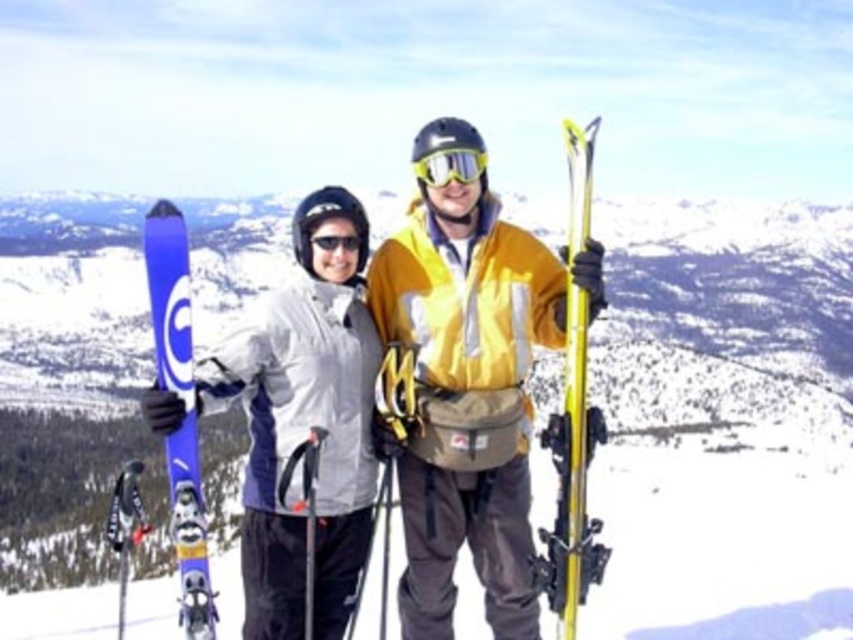
Is matte blue skis at center taller than yellow metallic ski at right?

In fact, matte blue skis at center may be shorter than yellow metallic ski at right.

Can you confirm if matte blue skis at center is thinner than yellow metallic ski at right?

In fact, matte blue skis at center might be wider than yellow metallic ski at right.

Between point (425, 362) and point (567, 145), which one is positioned behind?

Point (425, 362)

At what (x,y) coordinates should I click in order to perform the action: click on matte blue skis at center. Please return your answer as a coordinate pair (x, y). The width and height of the screenshot is (853, 640). Looking at the image, I should click on (482, 396).

Is point (451, 380) less distant than point (444, 179)?

Yes, point (451, 380) is closer to viewer.

The height and width of the screenshot is (640, 853). Describe the element at coordinates (482, 396) in the screenshot. I see `matte blue skis at center` at that location.

Between point (462, 529) and point (468, 164), which one is positioned behind?

The point (462, 529) is more distant.

At what (x,y) coordinates should I click in order to perform the action: click on matte blue skis at center. Please return your answer as a coordinate pair (x, y). Looking at the image, I should click on (482, 396).

Is matte blue snowboard at left further to camera compared to glossy plastic goggles at center?

That is False.

Which is in front, point (219, 394) or point (457, 157)?

Positioned in front is point (219, 394).

Is point (279, 616) positioned behind point (461, 177)?

No, it is not.

You are a GUI agent. You are given a task and a screenshot of the screen. Output one action in this format:
    pyautogui.click(x=<x>, y=<y>)
    Task: Click on the matte blue snowboard at left
    The image size is (853, 640).
    Given the screenshot: What is the action you would take?
    pyautogui.click(x=305, y=424)